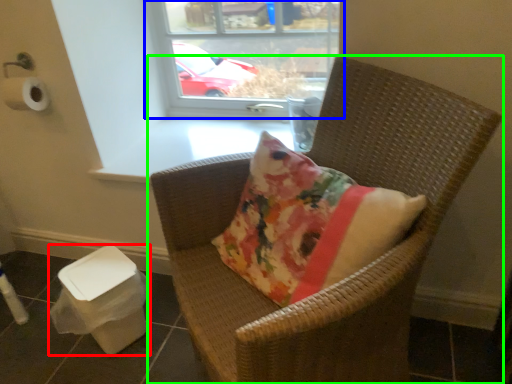
Question: Considering the real-world distances, which object is farthest from potty (highlighted by a red box)? window (highlighted by a blue box) or chair (highlighted by a green box)?

Choices:
 (A) window
 (B) chair

Answer: (A)